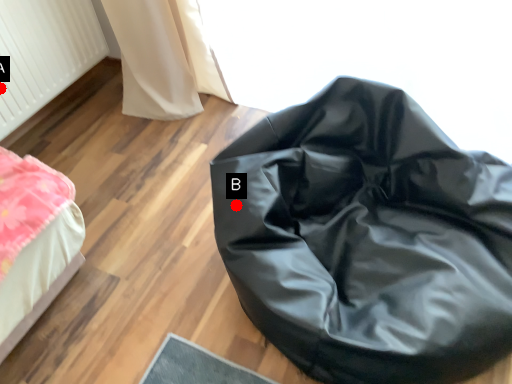
Question: Two points are circled on the image, labeled by A and B beside each circle. Which point is closer to the camera?

Choices:
 (A) A is closer
 (B) B is closer

Answer: (B)